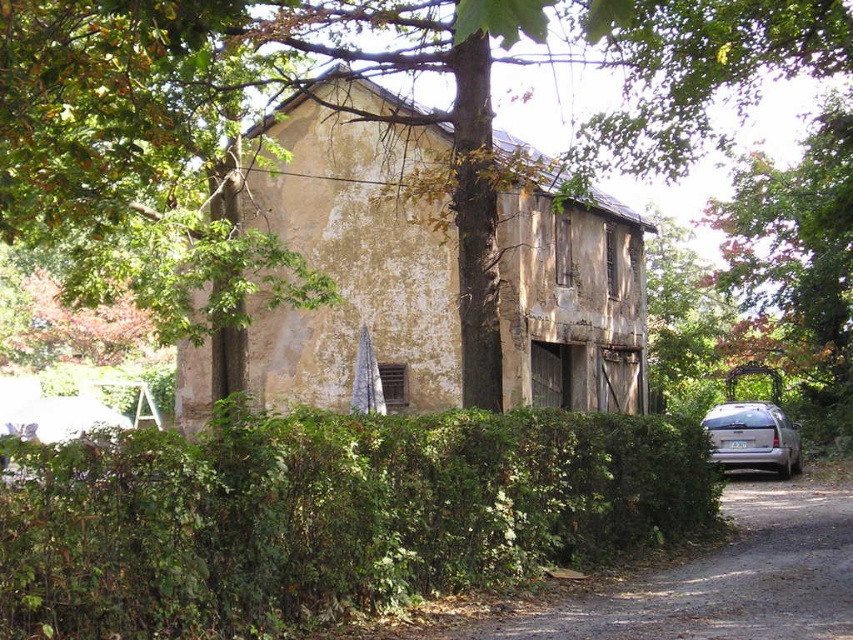
You are standing in front of the rustic building and want to take a photo of both the green leafy tree at upper center and the green leafy tree at right. Which tree should you position yourself to the left of to capture both in the frame?

You should position yourself to the left of the green leafy tree at right because the green leafy tree at upper center is to the left of it, so both will be in the frame.

You are standing in front of the building and want to take a photo of the silver metallic van at right without the green leafy hedge at center blocking the view. Which direction should you move to achieve this?

Move to the right side of the silver metallic van at right to avoid the green leafy hedge at center blocking the view.